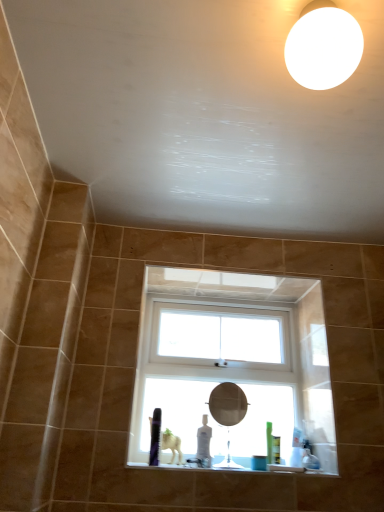
Where is `white matte light fixture at upper right`? This screenshot has height=512, width=384. white matte light fixture at upper right is located at coordinates (323, 46).

What do you see at coordinates (233, 370) in the screenshot? I see `white plastic window at center` at bounding box center [233, 370].

What do you see at coordinates (228, 413) in the screenshot? The height and width of the screenshot is (512, 384). I see `matte silver mirror at center` at bounding box center [228, 413].

This screenshot has height=512, width=384. Identify the location of white matte light fixture at upper right. (323, 46).

In terms of height, does white glossy window sill at lower center look taller or shorter compared to white plastic window at center?

In the image, white glossy window sill at lower center appears to be shorter than white plastic window at center.

Looking at their sizes, would you say white glossy window sill at lower center is wider or thinner than white plastic window at center?

In the image, white glossy window sill at lower center appears to be wider than white plastic window at center.

In terms of size, does white glossy window sill at lower center appear bigger or smaller than white plastic window at center?

In the image, white glossy window sill at lower center appears to be smaller than white plastic window at center.

Considering the sizes of objects matte silver mirror at center and white plastic window at center in the image provided, who is taller, matte silver mirror at center or white plastic window at center?

With more height is white plastic window at center.

In order to click on mirror that appears below the white plastic window at center (from a real-world perspective) in this screenshot , I will do `click(228, 413)`.

Considering the relative positions of matte silver mirror at center and white plastic window at center in the image provided, is matte silver mirror at center to the left of white plastic window at center from the viewer's perspective?

No.

Between matte silver mirror at center and white plastic window at center, which one has smaller size?

matte silver mirror at center is smaller.

Which of these two, white plastic window at center or white matte light fixture at upper right, is smaller?

Smaller between the two is white matte light fixture at upper right.

From a real-world perspective, between white plastic window at center and white matte light fixture at upper right, who is vertically lower?

white plastic window at center, from a real-world perspective.

The image size is (384, 512). I want to click on lighting above the white plastic window at center (from a real-world perspective), so click(323, 46).

Is white matte light fixture at upper right at the back of white plastic window at center?

white plastic window at center is not turned away from white matte light fixture at upper right.

Considering the relative positions of white matte light fixture at upper right and white plastic window at center in the image provided, is white matte light fixture at upper right to the right of white plastic window at center from the viewer's perspective?

Yes, white matte light fixture at upper right is to the right of white plastic window at center.

Is white matte light fixture at upper right shorter than white plastic window at center?

Yes, white matte light fixture at upper right is shorter than white plastic window at center.

Considering the relative sizes of white matte light fixture at upper right and white plastic window at center in the image provided, is white matte light fixture at upper right smaller than white plastic window at center?

Indeed, white matte light fixture at upper right has a smaller size compared to white plastic window at center.

Is white matte light fixture at upper right oriented away from white plastic window at center?

That's right, white matte light fixture at upper right is facing away from white plastic window at center.

What's the angular difference between white matte light fixture at upper right and matte silver mirror at center's facing directions?

There is a 0.242-degree angle between the facing directions of white matte light fixture at upper right and matte silver mirror at center.

Can you confirm if white matte light fixture at upper right is smaller than matte silver mirror at center?

Correct, white matte light fixture at upper right occupies less space than matte silver mirror at center.

Which of these two, white matte light fixture at upper right or matte silver mirror at center, stands taller?

matte silver mirror at center.

Which is more to the left, white matte light fixture at upper right or matte silver mirror at center?

matte silver mirror at center.

Looking at this image, is white glossy window sill at lower center located outside matte silver mirror at center?

Yes, white glossy window sill at lower center is not within matte silver mirror at center.

Considering the positions of objects white glossy window sill at lower center and matte silver mirror at center in the image provided, who is in front, white glossy window sill at lower center or matte silver mirror at center?

white glossy window sill at lower center.

Are white glossy window sill at lower center and matte silver mirror at center far apart?

Yes.

From a real-world perspective, does white glossy window sill at lower center stand above matte silver mirror at center?

No, from a real-world perspective, white glossy window sill at lower center is not over matte silver mirror at center

Does matte silver mirror at center touch white glossy window sill at lower center?

No, matte silver mirror at center is not beside white glossy window sill at lower center.

Is matte silver mirror at center wider than white glossy window sill at lower center?

In fact, matte silver mirror at center might be narrower than white glossy window sill at lower center.

Based on the photo, is matte silver mirror at center at the left side of white glossy window sill at lower center?

Incorrect, matte silver mirror at center is not on the left side of white glossy window sill at lower center.

Which object is more forward, matte silver mirror at center or white glossy window sill at lower center?

Positioned in front is white glossy window sill at lower center.

In order to click on window above the white glossy window sill at lower center (from the image's perspective) in this screenshot , I will do [233, 370].

Locate an element on the screen. window above the matte silver mirror at center (from a real-world perspective) is located at coordinates (233, 370).

Based on their spatial positions, is white matte light fixture at upper right or white glossy window sill at lower center closer to matte silver mirror at center?

The object closer to matte silver mirror at center is white glossy window sill at lower center.

When comparing their distances from matte silver mirror at center, does white plastic window at center or white glossy window sill at lower center seem further?

white glossy window sill at lower center lies further to matte silver mirror at center than the other object.

From the image, which object appears to be farther from white plastic window at center, white glossy window sill at lower center or matte silver mirror at center?

matte silver mirror at center lies further to white plastic window at center than the other object.

Looking at the image, which one is located further to white plastic window at center, matte silver mirror at center or white glossy window sill at lower center?

The object further to white plastic window at center is matte silver mirror at center.

Based on their spatial positions, is white glossy window sill at lower center or white plastic window at center further from white matte light fixture at upper right?

The object further to white matte light fixture at upper right is white glossy window sill at lower center.

Estimate the real-world distances between objects in this image. Which object is closer to matte silver mirror at center, white plastic window at center or white matte light fixture at upper right?

white plastic window at center lies closer to matte silver mirror at center than the other object.

Which object lies further to the anchor point white matte light fixture at upper right, matte silver mirror at center or white glossy window sill at lower center?

matte silver mirror at center lies further to white matte light fixture at upper right than the other object.

Which object lies nearer to the anchor point matte silver mirror at center, white matte light fixture at upper right or white plastic window at center?

Among the two, white plastic window at center is located nearer to matte silver mirror at center.

You are a GUI agent. You are given a task and a screenshot of the screen. Output one action in this format:
    pyautogui.click(x=<x>, y=<y>)
    Task: Click on the window that lies between white matte light fixture at upper right and matte silver mirror at center from top to bottom
    
    Given the screenshot: What is the action you would take?
    pyautogui.click(x=233, y=370)

The width and height of the screenshot is (384, 512). What are the coordinates of `mirror between white glossy window sill at lower center and white plastic window at center along the z-axis` in the screenshot? It's located at (228, 413).

Where is `mirror between white matte light fixture at upper right and white glossy window sill at lower center in the vertical direction`? mirror between white matte light fixture at upper right and white glossy window sill at lower center in the vertical direction is located at coordinates (228, 413).

The width and height of the screenshot is (384, 512). In order to click on window that lies between white matte light fixture at upper right and white glossy window sill at lower center from top to bottom in this screenshot , I will do `click(233, 370)`.